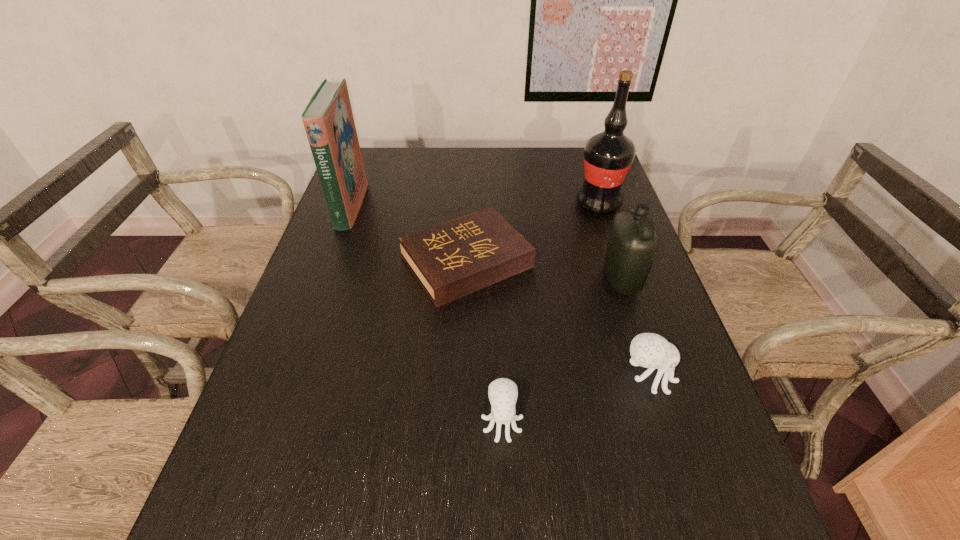
You are a GUI agent. You are given a task and a screenshot of the screen. Output one action in this format:
    pyautogui.click(x=<x>, y=<y>)
    Task: Click on the vacant area that lies between the wine bottle and the left octopus
    The image size is (960, 540).
    Given the screenshot: What is the action you would take?
    pyautogui.click(x=550, y=313)

The image size is (960, 540). Identify the location of free space that is in between the nearer octopus and the left hardback book. (426, 314).

This screenshot has width=960, height=540. Find the location of `object that stands as the second closest to the left hardback book`. object that stands as the second closest to the left hardback book is located at coordinates (503, 392).

Identify which object is the fourth closest to the fifth farthest object. Please provide its 2D coordinates. Your answer should be formatted as a tuple, i.e. [(x, y)], where the tuple contains the x and y coordinates of a point satisfying the conditions above.

[(608, 156)]

The width and height of the screenshot is (960, 540). In order to click on vacant position in the image that satisfies the following two spatial constraints: 1. on the cover of the bottle; 2. on the right side of the left hardback book in this screenshot , I will do [324, 280].

I want to click on vacant space that satisfies the following two spatial constraints: 1. on the cover of the third tallest object; 2. on the right side of the second tallest object, so click(324, 280).

Locate an element on the screen. The height and width of the screenshot is (540, 960). vacant region that satisfies the following two spatial constraints: 1. on the back side of the fourth shortest object; 2. on the right side of the wine bottle is located at coordinates (596, 205).